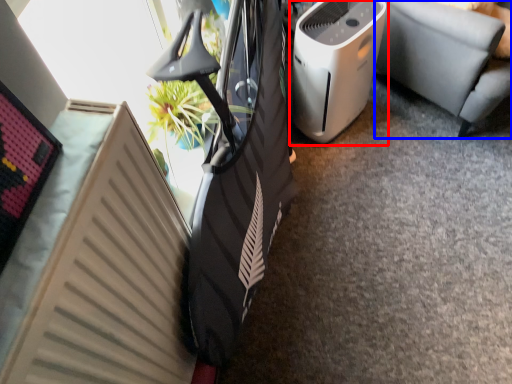
Question: Among these objects, which one is farthest to the camera, home appliance (highlighted by a red box) or furniture (highlighted by a blue box)?

Choices:
 (A) home appliance
 (B) furniture

Answer: (A)